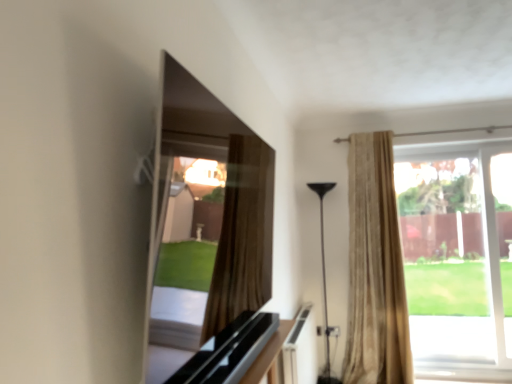
Question: Does smooth glass tv at upper center lie in front of clear glass window at right?

Choices:
 (A) no
 (B) yes

Answer: (B)

Question: Is smooth glass tv at upper center aimed at clear glass window at right?

Choices:
 (A) yes
 (B) no

Answer: (B)

Question: From a real-world perspective, is smooth glass tv at upper center physically below clear glass window at right?

Choices:
 (A) no
 (B) yes

Answer: (A)

Question: Can you confirm if smooth glass tv at upper center is shorter than clear glass window at right?

Choices:
 (A) yes
 (B) no

Answer: (A)

Question: Considering the relative sizes of smooth glass tv at upper center and clear glass window at right in the image provided, is smooth glass tv at upper center smaller than clear glass window at right?

Choices:
 (A) no
 (B) yes

Answer: (B)

Question: Is clear glass window at right wider or thinner than smooth glass tv at upper center?

Choices:
 (A) thin
 (B) wide

Answer: (A)

Question: Is clear glass window at right inside or outside of smooth glass tv at upper center?

Choices:
 (A) outside
 (B) inside

Answer: (A)

Question: From a real-world perspective, relative to smooth glass tv at upper center, is clear glass window at right vertically above or below?

Choices:
 (A) below
 (B) above

Answer: (A)

Question: Considering the relative positions of clear glass window at right and smooth glass tv at upper center in the image provided, is clear glass window at right to the left or to the right of smooth glass tv at upper center?

Choices:
 (A) right
 (B) left

Answer: (A)

Question: From a real-world perspective, relative to black glossy floor lamp at center, is beige textured curtain at right vertically above or below?

Choices:
 (A) above
 (B) below

Answer: (A)

Question: From their relative heights in the image, would you say beige textured curtain at right is taller or shorter than black glossy floor lamp at center?

Choices:
 (A) short
 (B) tall

Answer: (B)

Question: Is beige textured curtain at right situated inside black glossy floor lamp at center or outside?

Choices:
 (A) outside
 (B) inside

Answer: (A)

Question: Considering the positions of beige textured curtain at right and black glossy floor lamp at center in the image, is beige textured curtain at right wider or thinner than black glossy floor lamp at center?

Choices:
 (A) thin
 (B) wide

Answer: (A)

Question: Based on their positions, is smooth glass tv at upper center located to the left or right of beige textured curtain at right?

Choices:
 (A) left
 (B) right

Answer: (A)

Question: From a real-world perspective, relative to beige textured curtain at right, is smooth glass tv at upper center vertically above or below?

Choices:
 (A) above
 (B) below

Answer: (A)